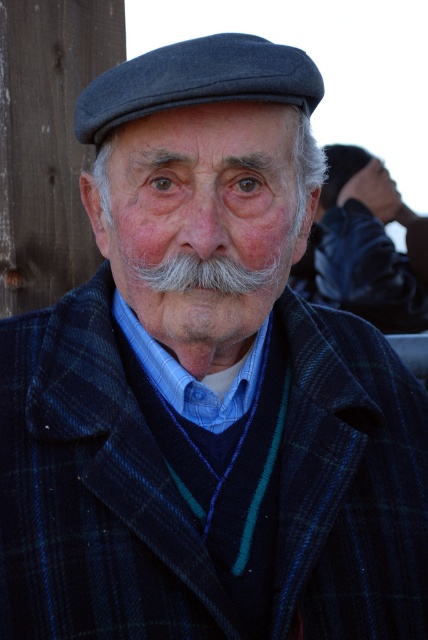
You are a photographer adjusting your camera settings to focus on two points in the image. The points are labeled as point (344, 246) and point (276, 72). Which point is closer to the camera?

Point (344, 246) is further to the camera than point (276, 72), so point (276, 72) is closer to the camera.

You are a photographer setting up for a portrait session. You have a camera with a 50mm lens and want to ensure both the gray woolen cap at upper center and the dark blue felt cap at upper center are in focus. Given that the depth of field at this lens setting allows for sharp focus within 7 feet of the subject, will both caps be in focus?

The distance between the gray woolen cap at upper center and the dark blue felt cap at upper center is 8.19 feet. Since the depth of field only covers 7 feet, the caps are slightly out of the focus range. Therefore, both caps cannot be in focus simultaneously with the current lens setting.

You are a photographer taking a portrait of the elderly man. You notice the white mustache at center and the gray woolen cap at upper center. Which of these two features is narrower in width?

The white mustache at center is thinner than the gray woolen cap at upper center, so the white mustache at center is narrower in width.